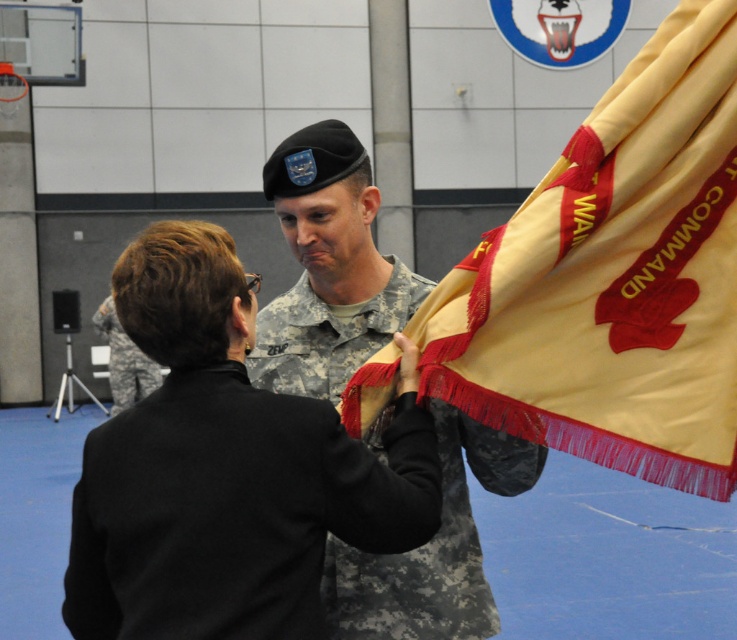
Question: Which object is closer to the camera taking this photo?

Choices:
 (A) camouflage fabric uniform at left
 (B) yellow satin flag at right
 (C) black fabric jacket at center
 (D) camouflage fabric uniform at center

Answer: (C)

Question: Which point appears farthest from the camera in this image?

Choices:
 (A) (425, 577)
 (B) (66, 608)
 (C) (136, 378)

Answer: (C)

Question: Which point is closer to the camera taking this photo?

Choices:
 (A) (128, 396)
 (B) (632, 333)
 (C) (413, 612)

Answer: (B)

Question: Is black fabric jacket at center wider than camouflage fabric uniform at center?

Choices:
 (A) no
 (B) yes

Answer: (B)

Question: Does yellow satin flag at right have a smaller size compared to black fabric jacket at center?

Choices:
 (A) no
 (B) yes

Answer: (A)

Question: Does yellow satin flag at right appear over camouflage fabric uniform at center?

Choices:
 (A) no
 (B) yes

Answer: (B)